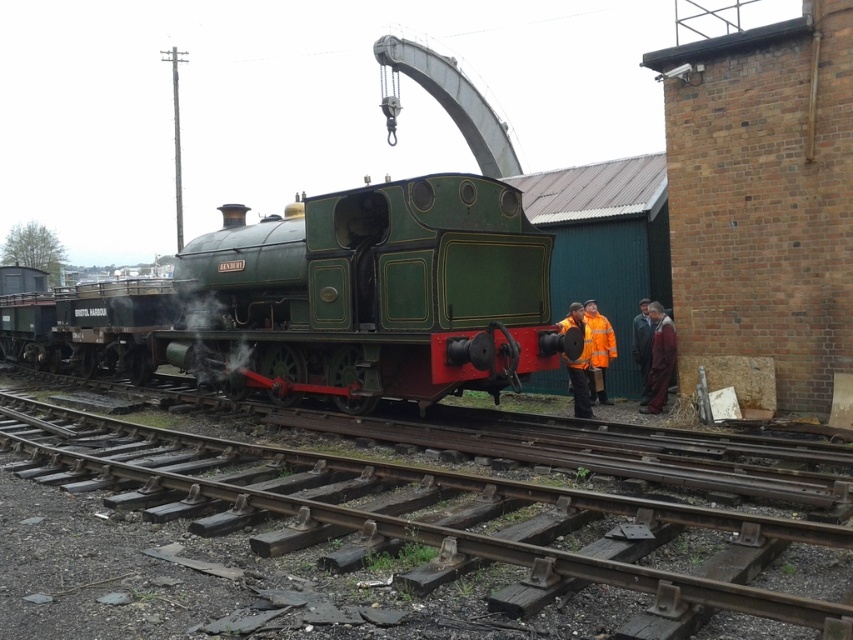
Question: Which is farther from the orange jacket at center?

Choices:
 (A) green matte steam at center
 (B) rusty metal track at center

Answer: (A)

Question: Which point is closer to the camera?

Choices:
 (A) green polished wood train at center
 (B) orange jacket at center

Answer: (A)

Question: Which object is farther from the camera taking this photo?

Choices:
 (A) green matte steam at center
 (B) orange jacket at center
 (C) dark blue fabric coat at right

Answer: (B)

Question: Does dark blue fabric coat at right appear under hi-visibility jacket at center?

Choices:
 (A) yes
 (B) no

Answer: (A)

Question: Is dark blue fabric coat at right below hi-visibility jacket at center?

Choices:
 (A) yes
 (B) no

Answer: (A)

Question: Does rusty metal track at center come in front of dark blue fabric coat at right?

Choices:
 (A) yes
 (B) no

Answer: (A)